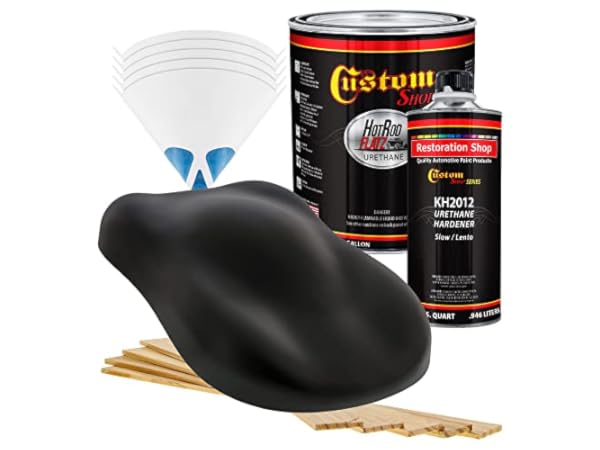
Identify the location of seat. (224, 248).